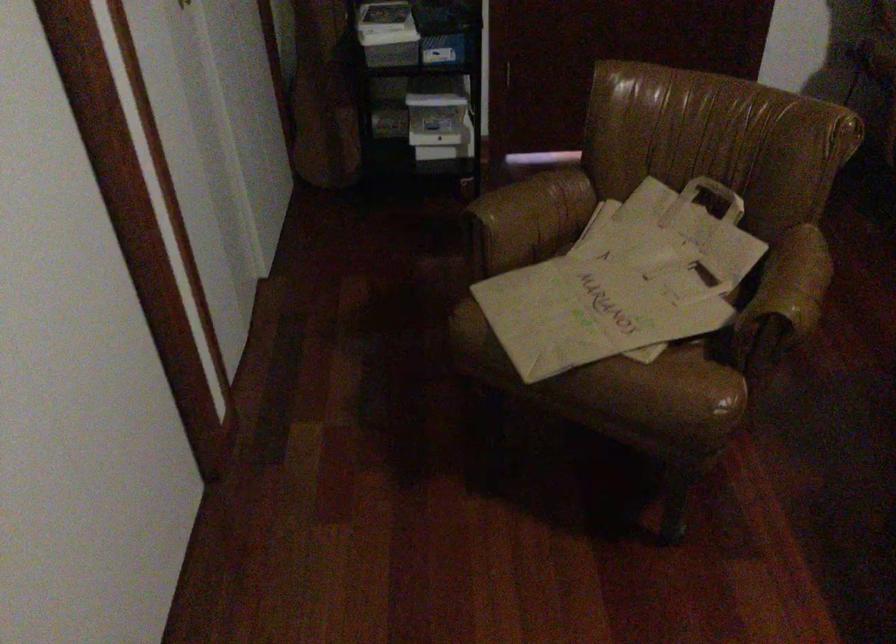
Where would you lift the paper bag handle? Please return your answer as a coordinate pair (x, y).

(716, 194)